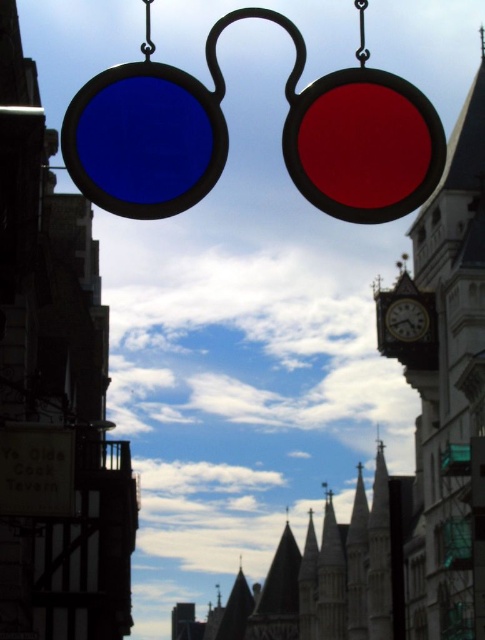
Question: Which point appears farthest from the camera in this image?

Choices:
 (A) (422, 314)
 (B) (427, 428)

Answer: (B)

Question: Is smooth stone clock tower at right bigger than wooden clock at center?

Choices:
 (A) yes
 (B) no

Answer: (A)

Question: Does smooth stone clock tower at right have a greater width compared to wooden clock at center?

Choices:
 (A) yes
 (B) no

Answer: (A)

Question: Does smooth stone clock tower at right have a larger size compared to wooden clock at center?

Choices:
 (A) yes
 (B) no

Answer: (A)

Question: Which point is closer to the camera taking this photo?

Choices:
 (A) (398, 330)
 (B) (389, 353)

Answer: (A)